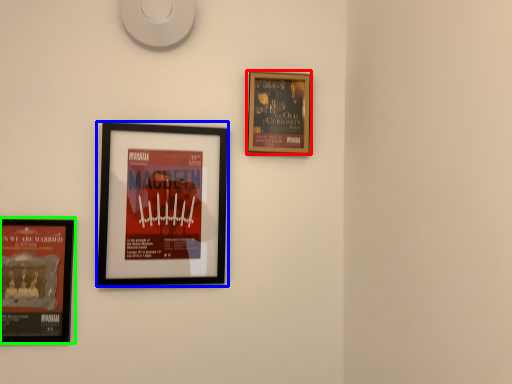
Question: Which is farther away from picture frame (highlighted by a red box)? picture frame (highlighted by a blue box) or picture frame (highlighted by a green box)?

Choices:
 (A) picture frame
 (B) picture frame

Answer: (B)